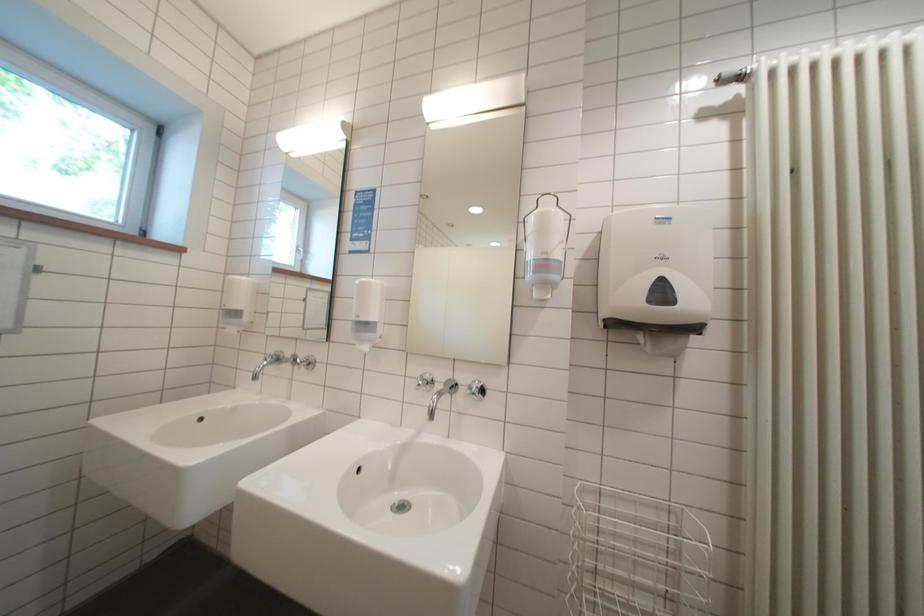
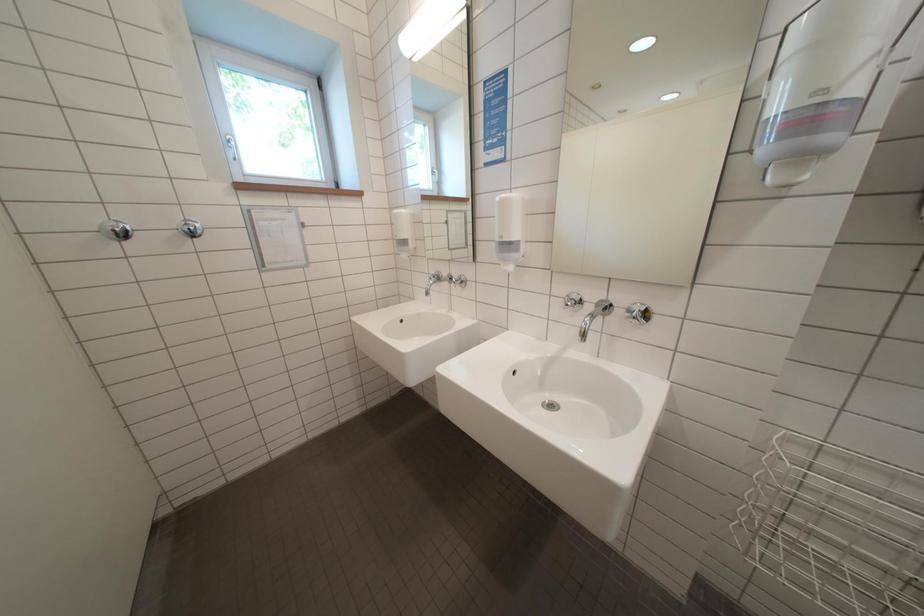
First-person continuous shooting, in which direction is the camera rotating?

The camera's rotation is toward left-down.